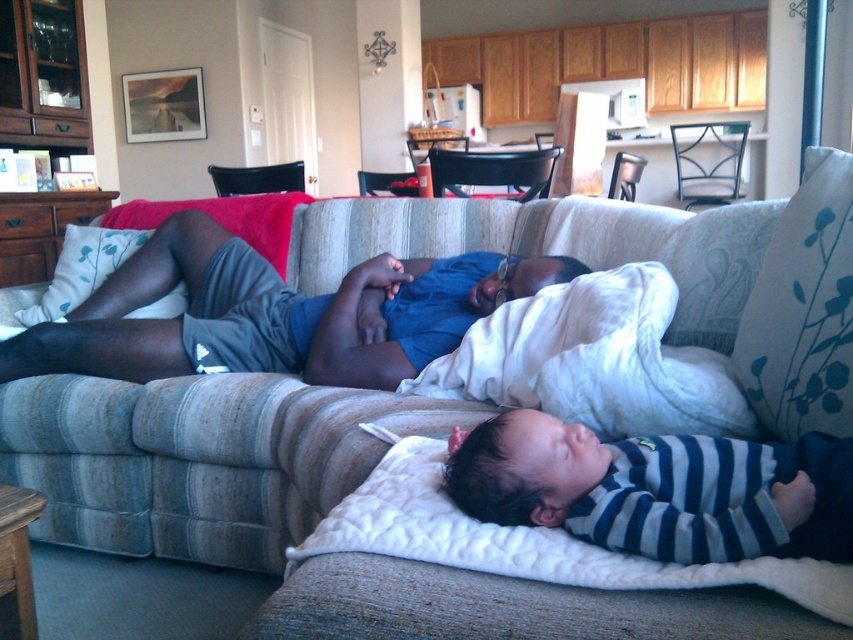
You are a photographer taking a picture of the striped cotton onesie at center and the striped fabric baby at lower right. Which object should you focus on first if you want to capture both clearly in the same frame?

You should focus on the striped cotton onesie at center first because the striped fabric baby at lower right is behind it, so focusing on the front object ensures both are in focus.

You are a parent trying to cover your baby with the white plush blanket at lower center while they are wearing the striped cotton onesie at center. Can you reach the blanket without moving the baby?

The distance between the striped cotton onesie at center and the white plush blanket at lower center is 80.82 centimeters. If the parent can reach this distance, they can cover the baby without moving them. However, the question does not provide information about the parent or baby size, so it is uncertain. The answer should be based on the given distance alone. Since the distance is 80.82 cm, the parent needs to be able to reach that span.

You are a parent trying to place a pacifier between the striped cotton onesie at center and the striped fabric baby at lower right. The pacifier is 10 centimeters long. Will there be enough space between them to place the pacifier?

The distance between the striped cotton onesie at center and the striped fabric baby at lower right is 95.53 centimeters. Since the pacifier is only 10 centimeters long, there is sufficient space to place it between them.